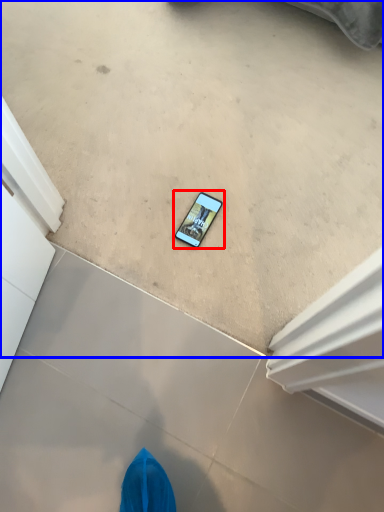
Question: Which of the following is the farthest to the observer, mobile phone (highlighted by a red box) or concrete (highlighted by a blue box)?

Choices:
 (A) mobile phone
 (B) concrete

Answer: (A)